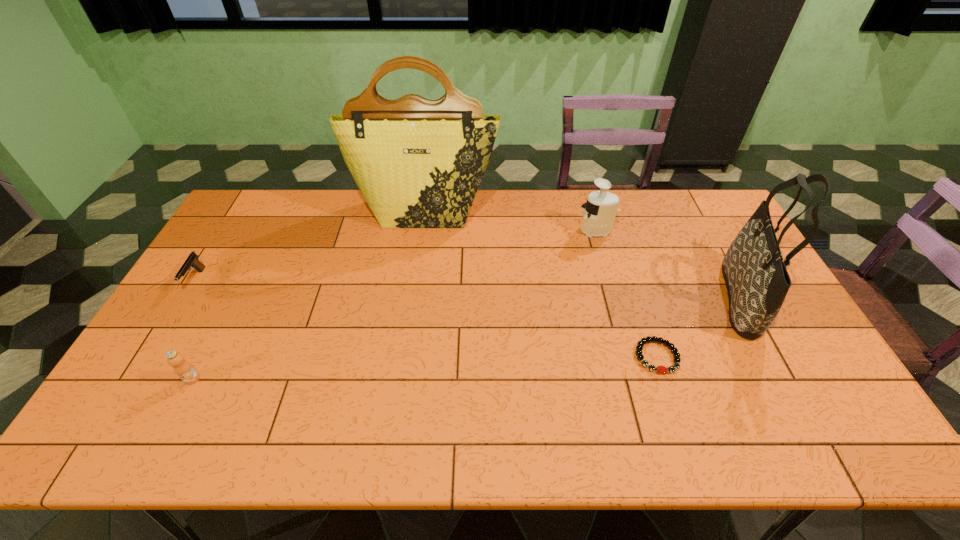
Locate an element on the screen. The width and height of the screenshot is (960, 540). vacant space that's between the second shortest object and the bracelet is located at coordinates (426, 319).

What are the coordinates of `vacant point located between the tallest object and the third tallest object` in the screenshot? It's located at (511, 221).

The image size is (960, 540). Find the location of `blank region between the leftmost object and the nearer tote bag`. blank region between the leftmost object and the nearer tote bag is located at coordinates (468, 289).

The height and width of the screenshot is (540, 960). Find the location of `unoccupied position between the shorter tote bag and the pistol`. unoccupied position between the shorter tote bag and the pistol is located at coordinates click(468, 289).

Identify the location of vacant region between the bracelet and the third tallest object. Image resolution: width=960 pixels, height=540 pixels. point(627,293).

Image resolution: width=960 pixels, height=540 pixels. What are the coordinates of `vacant space in between the nearer tote bag and the juicer` in the screenshot? It's located at (668, 264).

Identify which object is located as the fifth nearest to the second shortest object. Please provide its 2D coordinates. Your answer should be formatted as a tuple, i.e. [(x, y)], where the tuple contains the x and y coordinates of a point satisfying the conditions above.

[(757, 281)]

You are a GUI agent. You are given a task and a screenshot of the screen. Output one action in this format:
    pyautogui.click(x=<x>, y=<y>)
    Task: Click on the object that is the fourth closest one to the taller tote bag
    
    Given the screenshot: What is the action you would take?
    pyautogui.click(x=182, y=368)

Image resolution: width=960 pixels, height=540 pixels. Find the location of `free spot that satisfies the following two spatial constraints: 1. at the muzzle of the right tote bag; 2. on the right side of the leftmost object`. free spot that satisfies the following two spatial constraints: 1. at the muzzle of the right tote bag; 2. on the right side of the leftmost object is located at coordinates (185, 297).

Where is `free space that satisfies the following two spatial constraints: 1. on the front-facing side of the tallest object; 2. on the left side of the nearer tote bag`? The image size is (960, 540). free space that satisfies the following two spatial constraints: 1. on the front-facing side of the tallest object; 2. on the left side of the nearer tote bag is located at coordinates (413, 297).